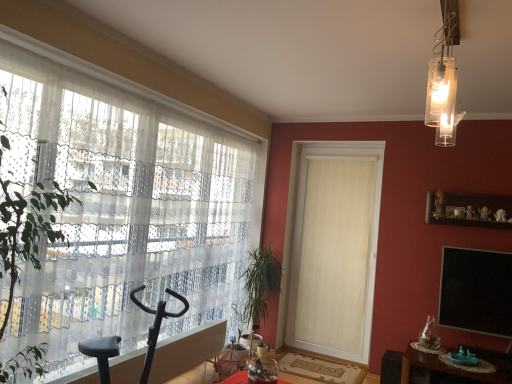
Describe the element at coordinates (121, 208) in the screenshot. This screenshot has width=512, height=384. I see `white sheer curtain at left` at that location.

What do you see at coordinates (469, 209) in the screenshot? The width and height of the screenshot is (512, 384). I see `wooden shelf at upper right` at bounding box center [469, 209].

What do you see at coordinates (476, 291) in the screenshot? I see `black matte screen at upper right` at bounding box center [476, 291].

What do you see at coordinates (260, 285) in the screenshot? I see `green leafy plant at center` at bounding box center [260, 285].

The width and height of the screenshot is (512, 384). What do you see at coordinates (334, 249) in the screenshot?
I see `white textured door at center` at bounding box center [334, 249].

Where is `white sheer curtain at left`? The width and height of the screenshot is (512, 384). white sheer curtain at left is located at coordinates coord(121,208).

At what (x,y) coordinates should I click in order to perform the action: click on window screen that is in front of the white textured door at center. Please return your answer as a coordinate pair (x, y). Image resolution: width=512 pixels, height=384 pixels. Looking at the image, I should click on (476, 291).

Is white textured door at center at the left side of black matte screen at upper right?

Yes.

Which object is wider, white textured door at center or black matte screen at upper right?

white textured door at center is wider.

Is wooden shelf at upper right turned away from green leafy plant at left?

No, green leafy plant at left is not at the back of wooden shelf at upper right.

Can you confirm if wooden shelf at upper right is positioned to the left of green leafy plant at left?

No, wooden shelf at upper right is not to the left of green leafy plant at left.

The width and height of the screenshot is (512, 384). Find the location of `window sill behind the green leafy plant at left`. window sill behind the green leafy plant at left is located at coordinates (469, 209).

Is green leafy plant at left far away from white textured radiator at lower left?

Indeed, green leafy plant at left is not near white textured radiator at lower left.

From the image's perspective, is green leafy plant at left located above white textured radiator at lower left?

Yes, from the image's perspective, green leafy plant at left is over white textured radiator at lower left.

Does green leafy plant at left turn towards white textured radiator at lower left?

No, green leafy plant at left is not facing towards white textured radiator at lower left.

Can you tell me how much green leafy plant at left and green leafy plant at center differ in facing direction?

They differ by 3.06 degrees in their facing directions.

Is green leafy plant at left spatially inside green leafy plant at center, or outside of it?

green leafy plant at left is located beyond the bounds of green leafy plant at center.

Considering the relative sizes of green leafy plant at left and green leafy plant at center in the image provided, is green leafy plant at left taller than green leafy plant at center?

Yes, green leafy plant at left is taller than green leafy plant at center.

From a real-world perspective, relative to green leafy plant at center, is green leafy plant at left vertically above or below?

green leafy plant at left is situated higher than green leafy plant at center in the real world.

Considering the relative positions of wooden shelf at upper right and clear glass pendant light at upper right in the image provided, is wooden shelf at upper right in front of clear glass pendant light at upper right?

No, wooden shelf at upper right is further to the viewer.

Find the location of `light fixture on the left of wooden shelf at upper right`. light fixture on the left of wooden shelf at upper right is located at coordinates (443, 82).

Based on the photo, are wooden shelf at upper right and clear glass pendant light at upper right located far from each other?

Yes, wooden shelf at upper right is far from clear glass pendant light at upper right.

Do you think wooden shelf at upper right is within clear glass pendant light at upper right, or outside of it?

wooden shelf at upper right exists outside the volume of clear glass pendant light at upper right.

Locate an element on the screen. window sill in front of the black matte screen at upper right is located at coordinates (469, 209).

In the image, is black matte screen at upper right positioned in front of or behind wooden shelf at upper right?

In the image, black matte screen at upper right appears behind wooden shelf at upper right.

From the image's perspective, is black matte screen at upper right positioned above or below wooden shelf at upper right?

black matte screen at upper right is situated lower than wooden shelf at upper right in the image.

Can you tell me how much black matte screen at upper right and wooden shelf at upper right differ in facing direction?

The angular difference between black matte screen at upper right and wooden shelf at upper right is 0.00029 degrees.

Does wooden shelf at upper right have a smaller size compared to green leafy plant at center?

Yes.

From the image's perspective, which is below, wooden shelf at upper right or green leafy plant at center?

green leafy plant at center, from the image's perspective.

Measure the distance from wooden shelf at upper right to green leafy plant at center.

wooden shelf at upper right is 1.87 meters from green leafy plant at center.

This screenshot has height=384, width=512. Identify the location of window sill positioned vertically above the green leafy plant at center (from a real-world perspective). (469, 209).

Locate an element on the screen. The height and width of the screenshot is (384, 512). window screen in front of the white textured door at center is located at coordinates pyautogui.click(x=476, y=291).

Locate an element on the screen. window sill that is on the right side of green leafy plant at left is located at coordinates (469, 209).

Considering their positions, is black matte screen at upper right positioned closer to clear glass pendant light at upper right than white textured door at center?

Among the two, black matte screen at upper right is located nearer to clear glass pendant light at upper right.

Estimate the real-world distances between objects in this image. Which object is closer to white textured door at center, wooden shelf at upper right or wooden tray at lower right?

wooden shelf at upper right.

Which object lies nearer to the anchor point wooden shelf at upper right, green leafy plant at left or white textured radiator at lower left?

The object closer to wooden shelf at upper right is white textured radiator at lower left.

From the image, which object appears to be nearer to wooden shelf at upper right, clear glass pendant light at upper right or green leafy plant at center?

The object closer to wooden shelf at upper right is green leafy plant at center.

When comparing their distances from wooden shelf at upper right, does green leafy plant at center or wooden tray at lower right seem closer?

Among the two, wooden tray at lower right is located nearer to wooden shelf at upper right.

Considering their positions, is clear glass pendant light at upper right positioned closer to wooden tray at lower right than green leafy plant at center?

green leafy plant at center is positioned closer to the anchor wooden tray at lower right.

Which object lies nearer to the anchor point white textured door at center, clear glass pendant light at upper right or wooden tray at lower right?

wooden tray at lower right.

Consider the image. From the image, which object appears to be farther from green leafy plant at center, green leafy plant at left or white textured door at center?

green leafy plant at left.

Where is `light fixture between green leafy plant at left and green leafy plant at center from front to back`? light fixture between green leafy plant at left and green leafy plant at center from front to back is located at coordinates (443, 82).

You are a GUI agent. You are given a task and a screenshot of the screen. Output one action in this format:
    pyautogui.click(x=<x>, y=<y>)
    Task: Click on the plant located between clear glass pendant light at upper right and white textured door at center in the depth direction
    The image size is (512, 384).
    Given the screenshot: What is the action you would take?
    pyautogui.click(x=260, y=285)

Identify the location of table between white textured radiator at lower left and wooden shelf at upper right. This screenshot has width=512, height=384. (444, 368).

Locate an element on the screen. The height and width of the screenshot is (384, 512). window screen between wooden shelf at upper right and wooden tray at lower right from top to bottom is located at coordinates (476, 291).